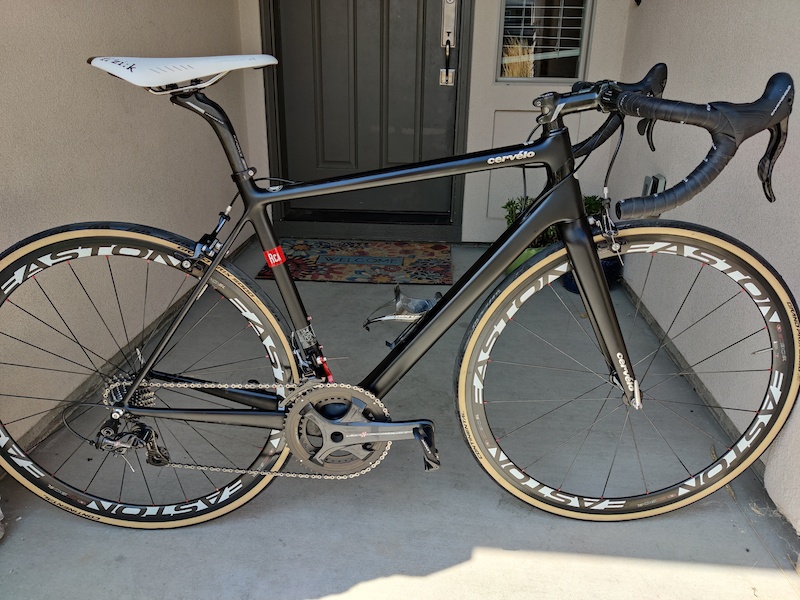
At what (x,y) coordinates should I click in order to perform the action: click on floor. Please return your answer as a coordinate pair (x, y). Looking at the image, I should click on (430, 527).